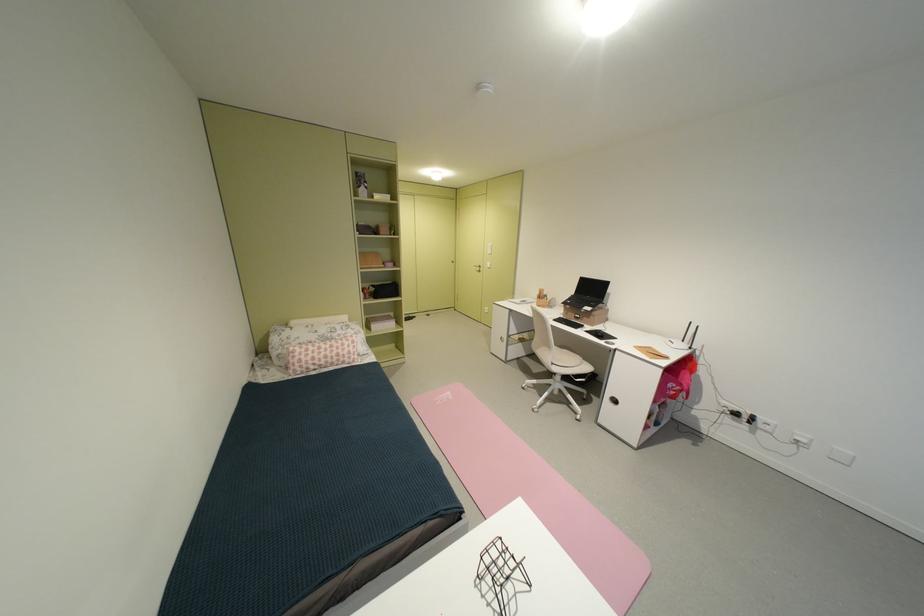
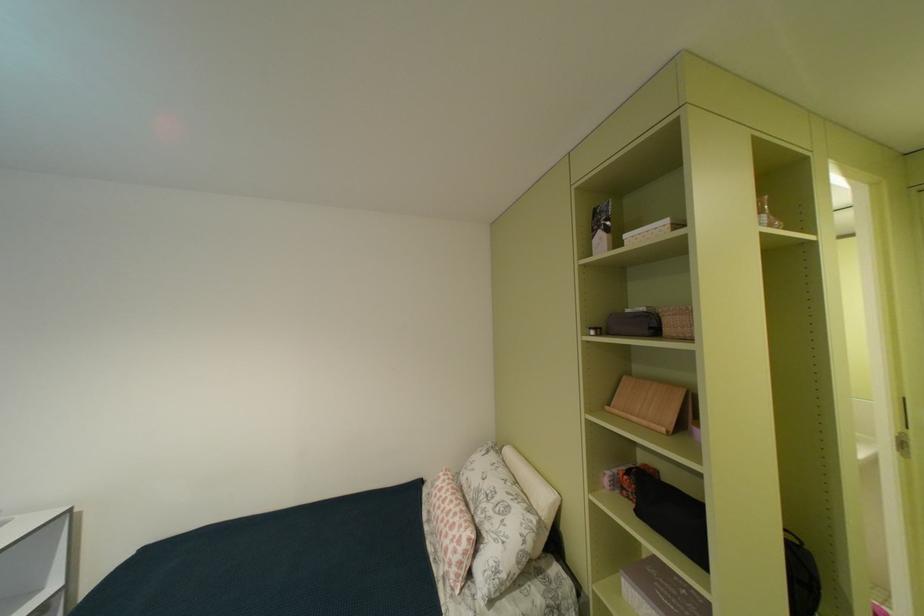
Question: I am providing you with two images of the same scene from different viewpoints. Please identify which objects are invisible in image2.

Choices:
 (A) clear glass bottle
 (B) pink patterned pillow
 (C) white bolster pillow
 (D) none of these

Answer: (D)